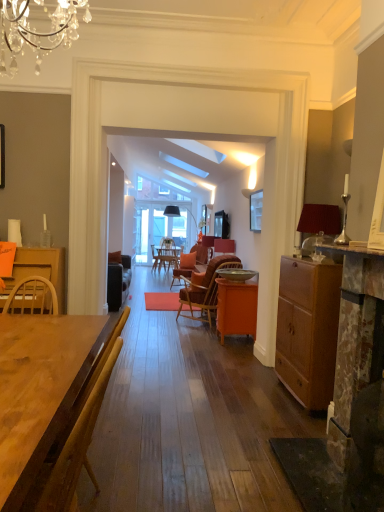
Measure the distance between matte black speaker at center and camera.

22.32 feet.

I want to click on matte red lampshade at right, so click(x=318, y=225).

Looking at their sizes, would you say matte black speaker at center is wider or thinner than matte brown cabinet at right?

Clearly, matte black speaker at center has less width compared to matte brown cabinet at right.

Between matte black speaker at center and matte brown cabinet at right, which one has more height?

Standing taller between the two is matte brown cabinet at right.

Locate an element on the screen. Image resolution: width=384 pixels, height=512 pixels. cabinetry below the matte black speaker at center (from a real-world perspective) is located at coordinates (308, 329).

Would you consider matte black speaker at center to be distant from matte brown cabinet at right?

That's right, there is a large distance between matte black speaker at center and matte brown cabinet at right.

Image resolution: width=384 pixels, height=512 pixels. I want to click on picture frame that appears on the right of brown woven chair at center, so click(256, 210).

From a real-world perspective, does matte black picture frame at upper center sit lower than brown woven chair at center?

No, from a real-world perspective, matte black picture frame at upper center is not under brown woven chair at center.

Considering the positions of objects matte black picture frame at upper center and brown woven chair at center in the image provided, who is more to the left, matte black picture frame at upper center or brown woven chair at center?

brown woven chair at center.

Based on their sizes in the image, would you say matte black speaker at center is bigger or smaller than matte red lampshade at right?

matte black speaker at center is smaller than matte red lampshade at right.

How different are the orientations of matte black speaker at center and matte red lampshade at right in degrees?

They differ by 2.33 degrees in their facing directions.

Looking at this image, measure the distance from matte black speaker at center to matte red lampshade at right.

matte black speaker at center is 3.46 meters away from matte red lampshade at right.

Is matte black speaker at center not within matte red lampshade at right?

Yes, matte black speaker at center is located beyond the bounds of matte red lampshade at right.

Considering the relative sizes of wooden table at center, arranged as the 2th desk when viewed from the right, and matte black speaker at center in the image provided, is wooden table at center, arranged as the 2th desk when viewed from the right, taller than matte black speaker at center?

Yes, wooden table at center, arranged as the 2th desk when viewed from the right, is taller than matte black speaker at center.

Is wooden table at center, the first desk positioned from the left, aimed at matte black speaker at center?

No, wooden table at center, the first desk positioned from the left, is not turned towards matte black speaker at center.

Is wooden table at center, positioned as the 1th desk in front-to-back order, far from matte black speaker at center?

Yes, wooden table at center, positioned as the 1th desk in front-to-back order, and matte black speaker at center are quite far apart.

At what (x,y) coordinates should I click in order to perform the action: click on loudspeaker behind the wooden table at center, the first desk positioned from the left. Please return your answer as a coordinate pair (x, y). The width and height of the screenshot is (384, 512). Looking at the image, I should click on (224, 246).

What's the angular difference between matte brown cabinet at right and orange matte cabinet at center, which appears as the first desk when viewed from the back,'s facing directions?

The angle between the facing direction of matte brown cabinet at right and the facing direction of orange matte cabinet at center, which appears as the first desk when viewed from the back, is 0.0796 degrees.

Which of these two, matte brown cabinet at right or orange matte cabinet at center, positioned as the 1th desk in right-to-left order, stands taller?

matte brown cabinet at right.

Is matte brown cabinet at right not near orange matte cabinet at center, which ranks as the 2th desk in front-to-back order?

That's right, there is a large distance between matte brown cabinet at right and orange matte cabinet at center, which ranks as the 2th desk in front-to-back order.

Is matte brown cabinet at right at the left side of orange matte cabinet at center, the second desk viewed from the left?

No.

Looking at this image, from the image's perspective, is matte black picture frame at upper center above or below orange matte cabinet at center, positioned as the 1th desk in right-to-left order?

From the image's perspective, matte black picture frame at upper center appears above orange matte cabinet at center, positioned as the 1th desk in right-to-left order.

From a real-world perspective, which is physically above, matte black picture frame at upper center or orange matte cabinet at center, positioned as the 1th desk in right-to-left order?

In real-world perspective, matte black picture frame at upper center is above.

You are a GUI agent. You are given a task and a screenshot of the screen. Output one action in this format:
    pyautogui.click(x=<x>, y=<y>)
    Task: Click on the picture frame that is in front of the orange matte cabinet at center, which ranks as the 2th desk in front-to-back order
    This screenshot has width=384, height=512.
    Given the screenshot: What is the action you would take?
    pyautogui.click(x=256, y=210)

Looking at their sizes, would you say matte black picture frame at upper center is wider or thinner than wooden table at center, the 2th desk in the back-to-front sequence?

matte black picture frame at upper center is thinner than wooden table at center, the 2th desk in the back-to-front sequence.

Is matte black picture frame at upper center closer to the viewer compared to wooden table at center, arranged as the 2th desk when viewed from the right?

No, the depth of matte black picture frame at upper center is greater than that of wooden table at center, arranged as the 2th desk when viewed from the right.

Considering the positions of objects matte black picture frame at upper center and wooden table at center, the first desk positioned from the left, in the image provided, who is more to the right, matte black picture frame at upper center or wooden table at center, the first desk positioned from the left,?

Positioned to the right is matte black picture frame at upper center.

Between matte black picture frame at upper center and wooden table at center, arranged as the 2th desk when viewed from the right, which one has less height?

matte black picture frame at upper center.

Identify the location of cabinetry that appears below the matte black speaker at center (from the image's perspective). This screenshot has height=512, width=384. coord(308,329).

You are a GUI agent. You are given a task and a screenshot of the screen. Output one action in this format:
    pyautogui.click(x=<x>, y=<y>)
    Task: Click on the picture frame above the brown woven chair at center (from the image's perspective)
    The image size is (384, 512).
    Given the screenshot: What is the action you would take?
    pyautogui.click(x=256, y=210)

Based on their spatial positions, is matte red lampshade at right or brown woven chair at center further from orange matte cabinet at center, which appears as the first desk when viewed from the back?

matte red lampshade at right lies further to orange matte cabinet at center, which appears as the first desk when viewed from the back, than the other object.

Which object lies nearer to the anchor point brown woven chair at center, matte black speaker at center or orange matte cabinet at center, which appears as the first desk when viewed from the back?

matte black speaker at center is closer to brown woven chair at center.

Based on their spatial positions, is matte black speaker at center or orange matte cabinet at center, which appears as the first desk when viewed from the back, further from matte black picture frame at upper center?

orange matte cabinet at center, which appears as the first desk when viewed from the back, is further to matte black picture frame at upper center.

From the image, which object appears to be nearer to matte black picture frame at upper center, orange matte cabinet at center, positioned as the 1th desk in right-to-left order, or matte black speaker at center?

The object closer to matte black picture frame at upper center is matte black speaker at center.

Based on their spatial positions, is orange matte cabinet at center, which appears as the first desk when viewed from the back, or wooden table at center, positioned as the 1th desk in front-to-back order, further from brown woven chair at center?

wooden table at center, positioned as the 1th desk in front-to-back order, is positioned further to the anchor brown woven chair at center.

From the image, which object appears to be nearer to matte black picture frame at upper center, matte brown cabinet at right or wooden table at center, the first desk positioned from the left?

Based on the image, matte brown cabinet at right appears to be nearer to matte black picture frame at upper center.

Looking at the image, which one is located closer to matte black speaker at center, matte black picture frame at upper center or brown woven chair at center?

The object closer to matte black speaker at center is brown woven chair at center.

Estimate the real-world distances between objects in this image. Which object is further from matte brown cabinet at right, matte black speaker at center or brown woven chair at center?

matte black speaker at center lies further to matte brown cabinet at right than the other object.

Locate an element on the screen. This screenshot has width=384, height=512. chair between matte brown cabinet at right and matte black speaker at center from front to back is located at coordinates (205, 288).

At what (x,y) coordinates should I click in order to perform the action: click on cabinetry between wooden table at center, the first desk positioned from the left, and matte black speaker at center in the front-back direction. Please return your answer as a coordinate pair (x, y). Looking at the image, I should click on (308, 329).

The width and height of the screenshot is (384, 512). Identify the location of lamp between wooden table at center, the 2th desk in the back-to-front sequence, and matte black speaker at center in the front-back direction. (318, 225).

Locate an element on the screen. Image resolution: width=384 pixels, height=512 pixels. chair between matte black picture frame at upper center and orange matte cabinet at center, positioned as the 1th desk in right-to-left order, vertically is located at coordinates (205, 288).